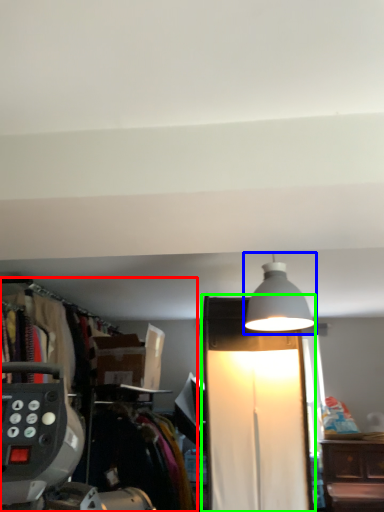
Question: Which is farther away from closet (highlighted by a red box)? lamp (highlighted by a blue box) or lamp (highlighted by a green box)?

Choices:
 (A) lamp
 (B) lamp

Answer: (A)